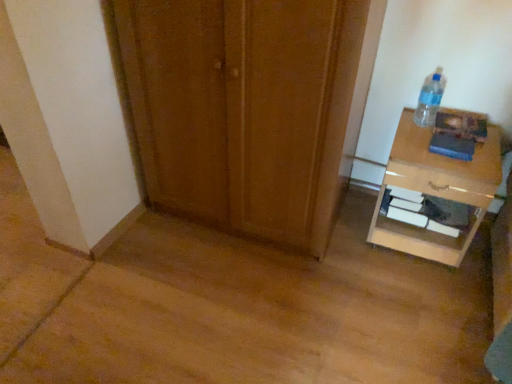
This screenshot has height=384, width=512. Describe the element at coordinates (243, 109) in the screenshot. I see `wooden door at center` at that location.

Where is `light brown glossy nightstand at right`? The width and height of the screenshot is (512, 384). light brown glossy nightstand at right is located at coordinates (436, 190).

Find the location of `wooden door at center`. wooden door at center is located at coordinates 243,109.

Is clear plastic bottle at upper right at the back of light brown glossy nightstand at right?

No, light brown glossy nightstand at right is not facing the opposite direction of clear plastic bottle at upper right.

Is light brown glossy nightstand at right inside the boundaries of clear plastic bottle at upper right, or outside?

light brown glossy nightstand at right is located beyond the bounds of clear plastic bottle at upper right.

Is light brown glossy nightstand at right closer to camera compared to clear plastic bottle at upper right?

Yes, the depth of light brown glossy nightstand at right is less than that of clear plastic bottle at upper right.

What's the angular difference between light brown glossy nightstand at right and clear plastic bottle at upper right's facing directions?

The facing directions of light brown glossy nightstand at right and clear plastic bottle at upper right are 2.53 degrees apart.

Which is closer, (420, 109) or (405, 249)?

Point (420, 109) appears to be farther away from the viewer than point (405, 249).

Does clear plastic bottle at upper right have a larger size compared to light brown glossy nightstand at right?

No.

Is clear plastic bottle at upper right positioned with its back to light brown glossy nightstand at right?

clear plastic bottle at upper right does not have its back to light brown glossy nightstand at right.

Would you say wooden door at center is outside light brown glossy nightstand at right?

That's correct, wooden door at center is outside of light brown glossy nightstand at right.

From a real-world perspective, is wooden door at center below light brown glossy nightstand at right?

No, from a real-world perspective, wooden door at center is not under light brown glossy nightstand at right.

How many degrees apart are the facing directions of wooden door at center and light brown glossy nightstand at right?

0.392 degrees.

Considering the sizes of objects wooden door at center and light brown glossy nightstand at right in the image provided, who is bigger, wooden door at center or light brown glossy nightstand at right?

wooden door at center.

Looking at this image, considering the positions of objects wooden door at center and clear plastic bottle at upper right in the image provided, who is more to the right, wooden door at center or clear plastic bottle at upper right?

clear plastic bottle at upper right.

In the scene shown: Is wooden door at center spatially inside clear plastic bottle at upper right, or outside of it?

wooden door at center is outside clear plastic bottle at upper right.

Could you tell me if wooden door at center is turned towards clear plastic bottle at upper right?

No, wooden door at center is not aimed at clear plastic bottle at upper right.

From the image's perspective, is wooden door at center positioned above or below clear plastic bottle at upper right?

From the image's perspective, wooden door at center appears below clear plastic bottle at upper right.

Identify the location of door in front of the light brown glossy nightstand at right. (243, 109).

Is light brown glossy nightstand at right bigger or smaller than wooden door at center?

Clearly, light brown glossy nightstand at right is smaller in size than wooden door at center.

Visually, is light brown glossy nightstand at right positioned to the left or to the right of wooden door at center?

From the image, it's evident that light brown glossy nightstand at right is to the right of wooden door at center.

From the picture: Which object is positioned more to the right, clear plastic bottle at upper right or wooden door at center?

From the viewer's perspective, clear plastic bottle at upper right appears more on the right side.

Which object is further away from the camera taking this photo, clear plastic bottle at upper right or wooden door at center?

clear plastic bottle at upper right is further away from the camera.

From the image's perspective, which object appears higher, clear plastic bottle at upper right or wooden door at center?

From the image's view, clear plastic bottle at upper right is above.

Is clear plastic bottle at upper right wider or thinner than wooden door at center?

Considering their sizes, clear plastic bottle at upper right looks slimmer than wooden door at center.

This screenshot has height=384, width=512. Find the location of `bottle that appears above the light brown glossy nightstand at right (from the image's perspective)`. bottle that appears above the light brown glossy nightstand at right (from the image's perspective) is located at coordinates (430, 99).

Identify the location of nightstand below the clear plastic bottle at upper right (from the image's perspective). The image size is (512, 384). click(436, 190).

From the image, which object appears to be farther from clear plastic bottle at upper right, light brown glossy nightstand at right or wooden door at center?

wooden door at center is positioned further to the anchor clear plastic bottle at upper right.

Which object lies nearer to the anchor point wooden door at center, clear plastic bottle at upper right or light brown glossy nightstand at right?

light brown glossy nightstand at right is closer to wooden door at center.

From the image, which object appears to be nearer to light brown glossy nightstand at right, wooden door at center or clear plastic bottle at upper right?

clear plastic bottle at upper right is closer to light brown glossy nightstand at right.

Based on their spatial positions, is wooden door at center or light brown glossy nightstand at right further from clear plastic bottle at upper right?

wooden door at center.

Looking at the image, which one is located closer to wooden door at center, light brown glossy nightstand at right or clear plastic bottle at upper right?

Among the two, light brown glossy nightstand at right is located nearer to wooden door at center.

Looking at the image, which one is located further to light brown glossy nightstand at right, clear plastic bottle at upper right or wooden door at center?

wooden door at center lies further to light brown glossy nightstand at right than the other object.

This screenshot has height=384, width=512. I want to click on bottle between wooden door at center and light brown glossy nightstand at right in the horizontal direction, so click(x=430, y=99).